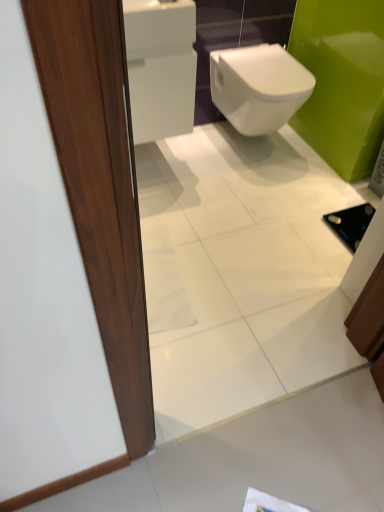
Question: Can you confirm if white paper at lower center is smaller than matte wood door at left?

Choices:
 (A) yes
 (B) no

Answer: (A)

Question: Does white paper at lower center turn towards matte wood door at left?

Choices:
 (A) no
 (B) yes

Answer: (B)

Question: Is white paper at lower center turned away from matte wood door at left?

Choices:
 (A) yes
 (B) no

Answer: (B)

Question: Is white paper at lower center positioned beyond the bounds of matte wood door at left?

Choices:
 (A) no
 (B) yes

Answer: (B)

Question: From a real-world perspective, is white paper at lower center located higher than matte wood door at left?

Choices:
 (A) yes
 (B) no

Answer: (B)

Question: Considering the relative sizes of white paper at lower center and matte wood door at left in the image provided, is white paper at lower center taller than matte wood door at left?

Choices:
 (A) no
 (B) yes

Answer: (A)

Question: Is white glossy bidet at center aimed at white glossy tile at lower left?

Choices:
 (A) no
 (B) yes

Answer: (A)

Question: Considering the relative sizes of white glossy bidet at center and white glossy tile at lower left in the image provided, is white glossy bidet at center wider than white glossy tile at lower left?

Choices:
 (A) yes
 (B) no

Answer: (A)

Question: From the image's perspective, is white glossy bidet at center below white glossy tile at lower left?

Choices:
 (A) yes
 (B) no

Answer: (B)

Question: Would you say white glossy tile at lower left is part of white glossy bidet at center's contents?

Choices:
 (A) yes
 (B) no

Answer: (B)

Question: Is white glossy bidet at center not inside white glossy tile at lower left?

Choices:
 (A) no
 (B) yes

Answer: (B)

Question: Can you confirm if white glossy bidet at center is bigger than white glossy tile at lower left?

Choices:
 (A) no
 (B) yes

Answer: (B)

Question: Considering the relative sizes of matte wood door at left and white paper at lower center in the image provided, is matte wood door at left wider than white paper at lower center?

Choices:
 (A) yes
 (B) no

Answer: (B)